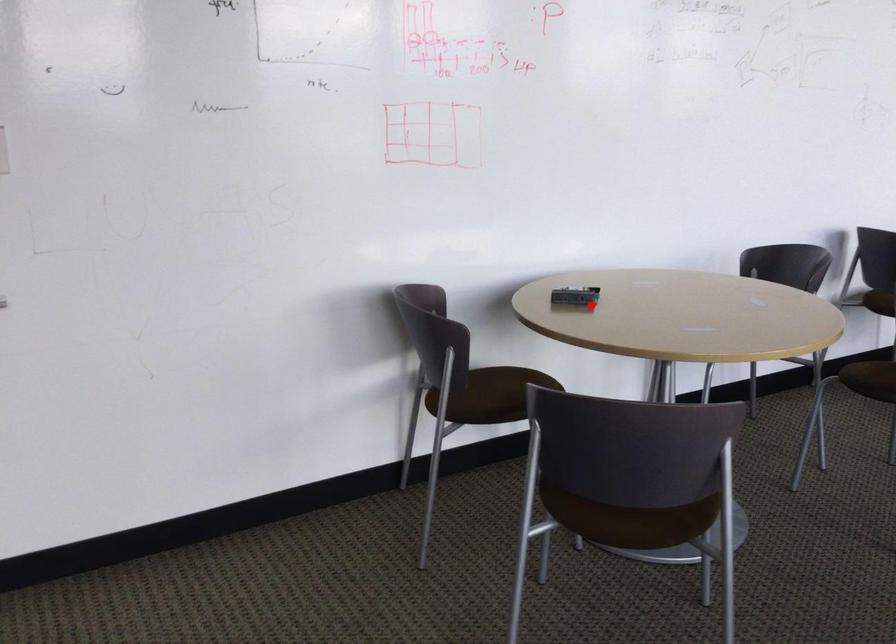
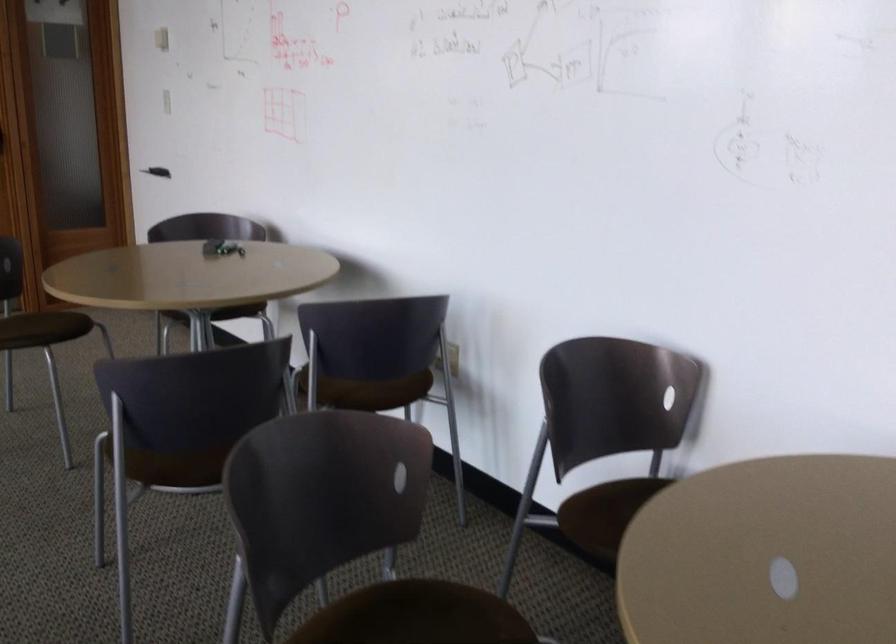
Question: A red point is marked in image1. In image2, is the corresponding 3D point closer to the camera or farther? Reply with the corresponding letter.

Choices:
 (A) The corresponding 3D point is closer.
 (B) The corresponding 3D point is farther.

Answer: (B)